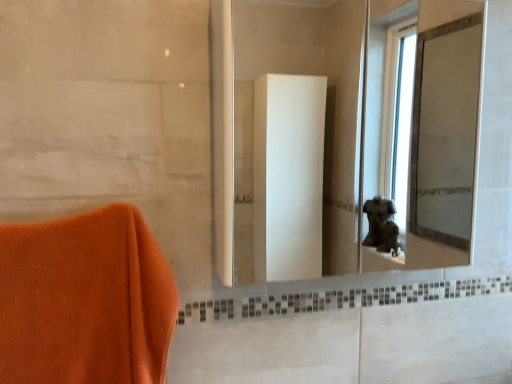
At what (x,y) coordinates should I click in order to perform the action: click on white glossy mirror at center. Please return your answer as a coordinate pair (x, y). The height and width of the screenshot is (384, 512). Looking at the image, I should click on (328, 94).

This screenshot has height=384, width=512. What do you see at coordinates (328, 94) in the screenshot?
I see `white glossy mirror at center` at bounding box center [328, 94].

You are a GUI agent. You are given a task and a screenshot of the screen. Output one action in this format:
    pyautogui.click(x=<x>, y=<y>)
    Task: Click on the white glossy mirror at center
    Image resolution: width=512 pixels, height=384 pixels.
    Given the screenshot: What is the action you would take?
    pyautogui.click(x=328, y=94)